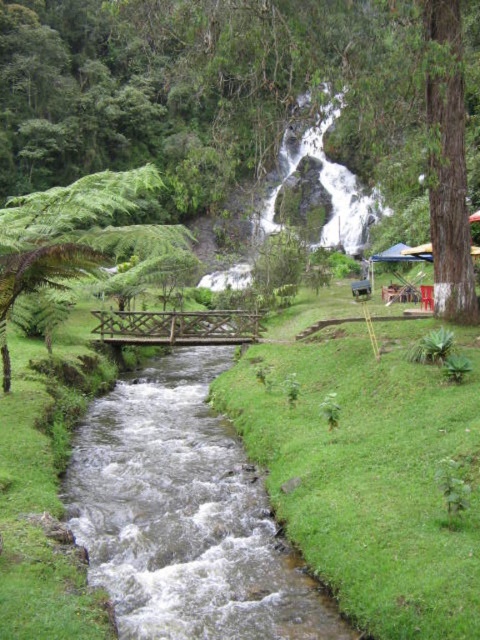
Question: Which object is farther from the camera taking this photo?

Choices:
 (A) green grass at center
 (B) green leafy tree at left

Answer: (B)

Question: Is the position of green grass at center less distant than that of green leafy tree at left?

Choices:
 (A) yes
 (B) no

Answer: (A)

Question: Which object is farther from the camera taking this photo?

Choices:
 (A) green leafy tree at left
 (B) green grass at center

Answer: (A)

Question: Which object is positioned farthest from the green grass at center?

Choices:
 (A) green leafy tree at left
 (B) clear water stream at center

Answer: (A)

Question: Does clear water stream at center have a greater width compared to green leafy tree at left?

Choices:
 (A) yes
 (B) no

Answer: (B)

Question: Is green grass at center bigger than green leafy tree at left?

Choices:
 (A) no
 (B) yes

Answer: (A)